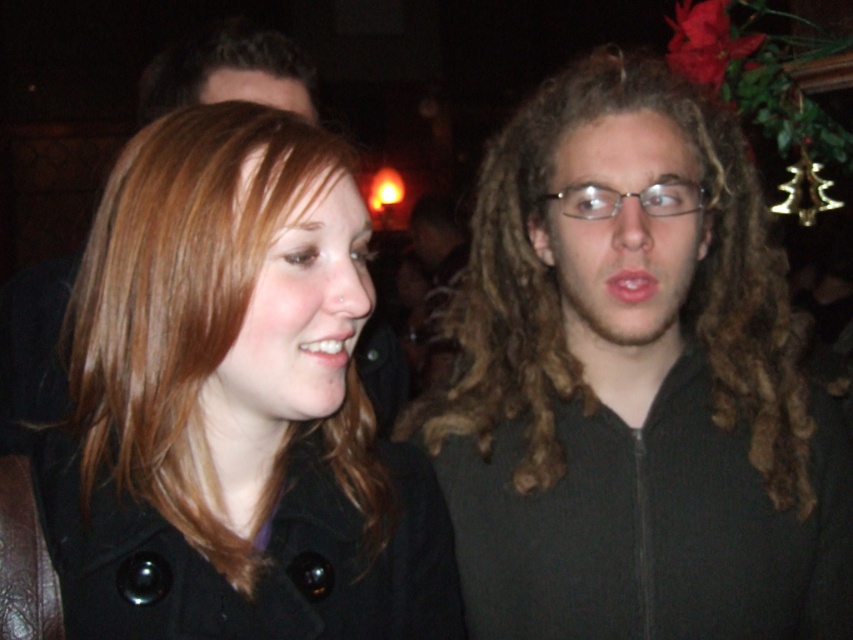
Does point (163, 324) come closer to viewer compared to point (670, 216)?

Yes, it is in front of point (670, 216).

At what (x,y) coordinates should I click in order to perform the action: click on matte black coat at left. Please return your answer as a coordinate pair (x, y). Looking at the image, I should click on (233, 403).

Is matte black coat at left positioned before curly brown hair at center?

Yes, matte black coat at left is in front of curly brown hair at center.

Does matte black coat at left have a smaller size compared to curly brown hair at center?

Incorrect, matte black coat at left is not smaller in size than curly brown hair at center.

Locate an element on the screen. matte black coat at left is located at coordinates (233, 403).

I want to click on matte black coat at left, so click(233, 403).

What do you see at coordinates (556, 284) in the screenshot? I see `curly brown hair at center` at bounding box center [556, 284].

Is point (595, 67) positioned in front of point (701, 202)?

No, it is behind (701, 202).

You are a GUI agent. You are given a task and a screenshot of the screen. Output one action in this format:
    pyautogui.click(x=<x>, y=<y>)
    Task: Click on the curly brown hair at center
    
    Given the screenshot: What is the action you would take?
    pyautogui.click(x=556, y=284)